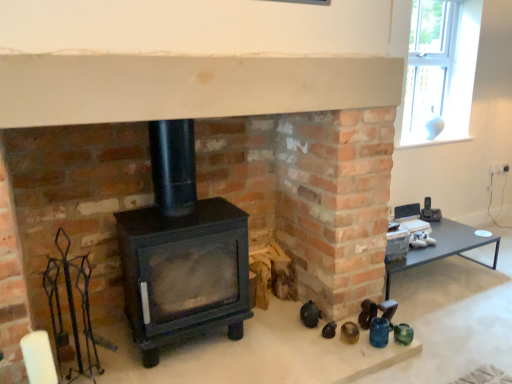
Question: Is matte black table at right not inside white glass vase at upper right?

Choices:
 (A) no
 (B) yes

Answer: (B)

Question: From the image's perspective, is matte black table at right under white glass vase at upper right?

Choices:
 (A) yes
 (B) no

Answer: (A)

Question: Can you confirm if matte black table at right is positioned to the right of white glass vase at upper right?

Choices:
 (A) yes
 (B) no

Answer: (B)

Question: From the image's perspective, is matte black table at right above white glass vase at upper right?

Choices:
 (A) yes
 (B) no

Answer: (B)

Question: Can you confirm if matte black table at right is shorter than white glass vase at upper right?

Choices:
 (A) yes
 (B) no

Answer: (A)

Question: From a real-world perspective, is matte black table at right on top of white glass vase at upper right?

Choices:
 (A) no
 (B) yes

Answer: (A)

Question: Is white glass vase at upper right closer to the viewer compared to black matte wood burning stove at center?

Choices:
 (A) no
 (B) yes

Answer: (A)

Question: From the image's perspective, is white glass vase at upper right located beneath black matte wood burning stove at center?

Choices:
 (A) yes
 (B) no

Answer: (B)

Question: Is white glass vase at upper right far from black matte wood burning stove at center?

Choices:
 (A) yes
 (B) no

Answer: (A)

Question: Is white glass vase at upper right at the right side of black matte wood burning stove at center?

Choices:
 (A) no
 (B) yes

Answer: (B)

Question: Is white glass vase at upper right aimed at black matte wood burning stove at center?

Choices:
 (A) no
 (B) yes

Answer: (A)

Question: Is white glass vase at upper right further to the viewer compared to black matte wood burning stove at center?

Choices:
 (A) yes
 (B) no

Answer: (A)

Question: From the image's perspective, is black matte wood burning stove at center under matte black table at right?

Choices:
 (A) yes
 (B) no

Answer: (B)